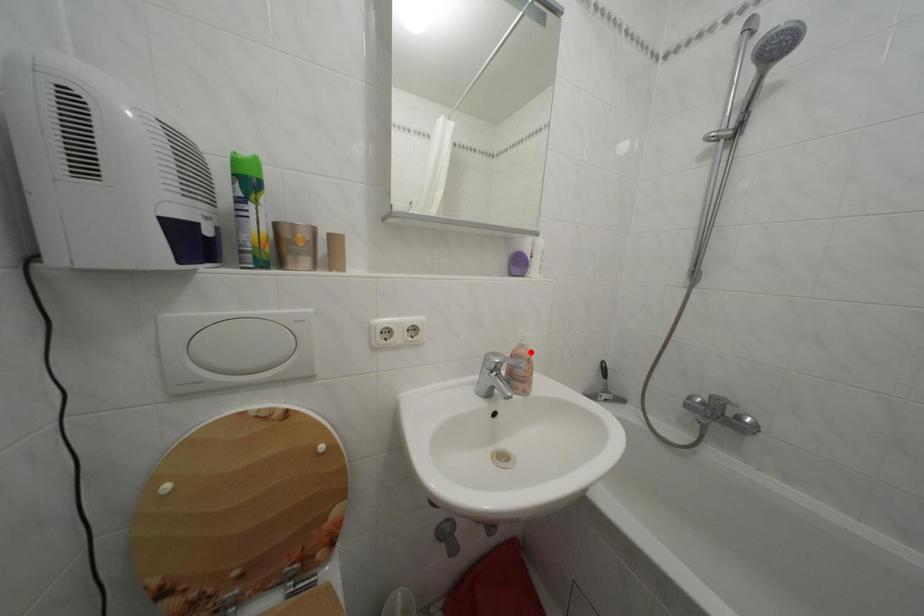
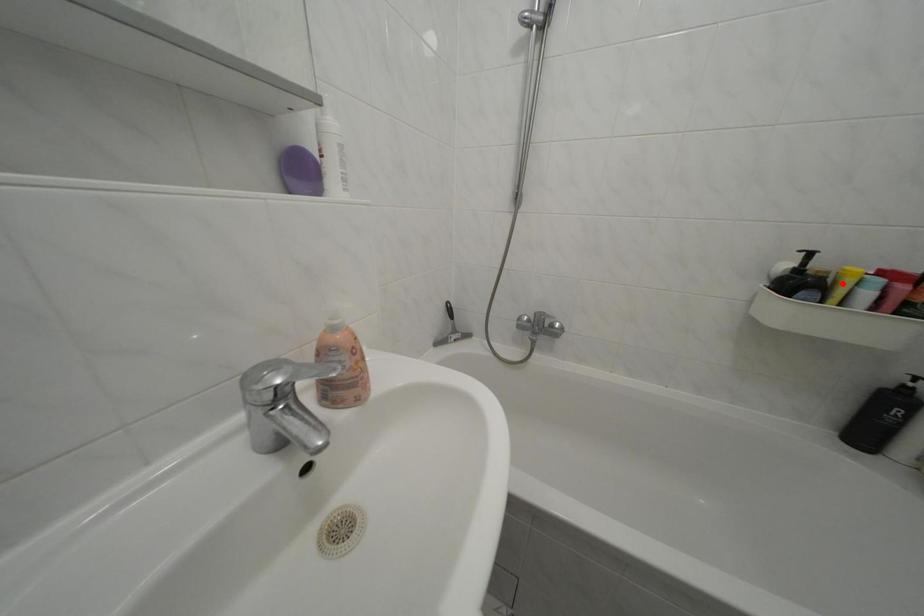
I am providing you with two images of the same scene from different viewpoints. A red point is marked on the first image and another point is marked on the second image. Is the marked point in image1 the same physical position as the marked point in image2?

No